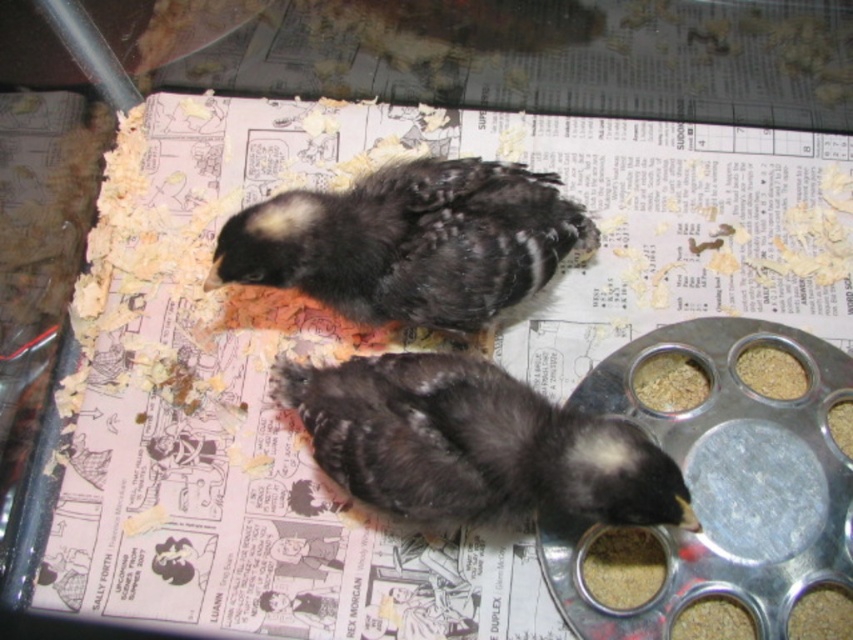
You are holding a 1.0 meter long stick and want to reach the point at coordinates point (494,387) in the image. Can you reach it with the stick?

The distance between the point (494,387) and the camera is 1.12 meters. Since the stick is only 1.0 meters long, you cannot reach the point with the stick.

You are a farmer checking on your chicks. You notice the dark gray fluffy chick at center and the brown crumbly food at right. Which object is located directly above the other?

The brown crumbly food at right is located directly above the dark gray fluffy chick at center because the dark gray fluffy chick at center is positioned under it.

You are a farmer checking on your chicks. You see the dark gray fluffy chick at center and the brown grain at right. Which object is larger?

The dark gray fluffy chick at center is bigger than the brown grain at right.